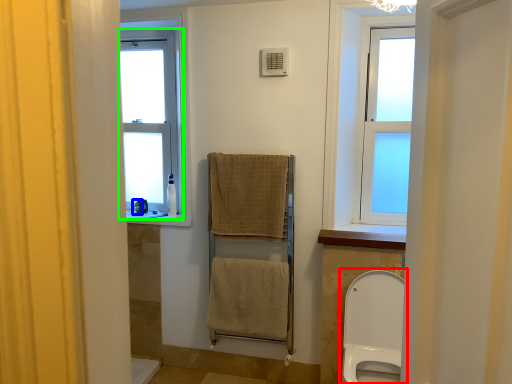
Question: Which object is the farthest from toilet (highlighted by a red box)? Choose among these: toiletry (highlighted by a blue box) or window (highlighted by a green box).

Choices:
 (A) toiletry
 (B) window

Answer: (A)